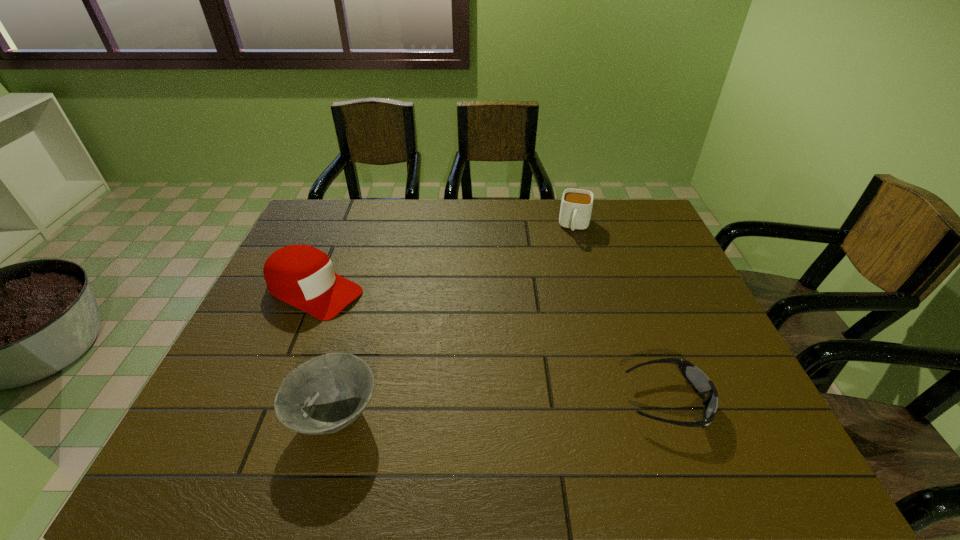
Where is `free spot on the desktop that is between the bowl and the sunglasses and is positioned on the side with the handle of the cup`? The height and width of the screenshot is (540, 960). free spot on the desktop that is between the bowl and the sunglasses and is positioned on the side with the handle of the cup is located at coordinates (546, 407).

Where is `vacant space on the desktop that is between the bowl and the shortest object and is positioned on the front-facing side of the baseball cap`? The width and height of the screenshot is (960, 540). vacant space on the desktop that is between the bowl and the shortest object and is positioned on the front-facing side of the baseball cap is located at coordinates (551, 407).